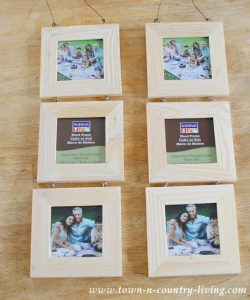
The image size is (250, 300). In order to click on pictures in this screenshot , I will do `click(60, 232)`, `click(177, 232)`, `click(189, 59)`, `click(80, 60)`.